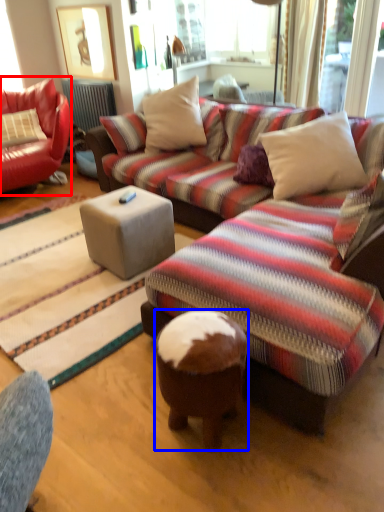
Question: Which object is further to the camera taking this photo, studio couch (highlighted by a red box) or stool (highlighted by a blue box)?

Choices:
 (A) studio couch
 (B) stool

Answer: (A)